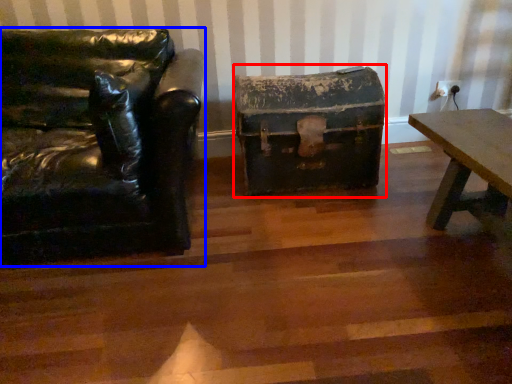
Question: Which object appears farthest to the camera in this image, box (highlighted by a red box) or chair (highlighted by a blue box)?

Choices:
 (A) box
 (B) chair

Answer: (A)